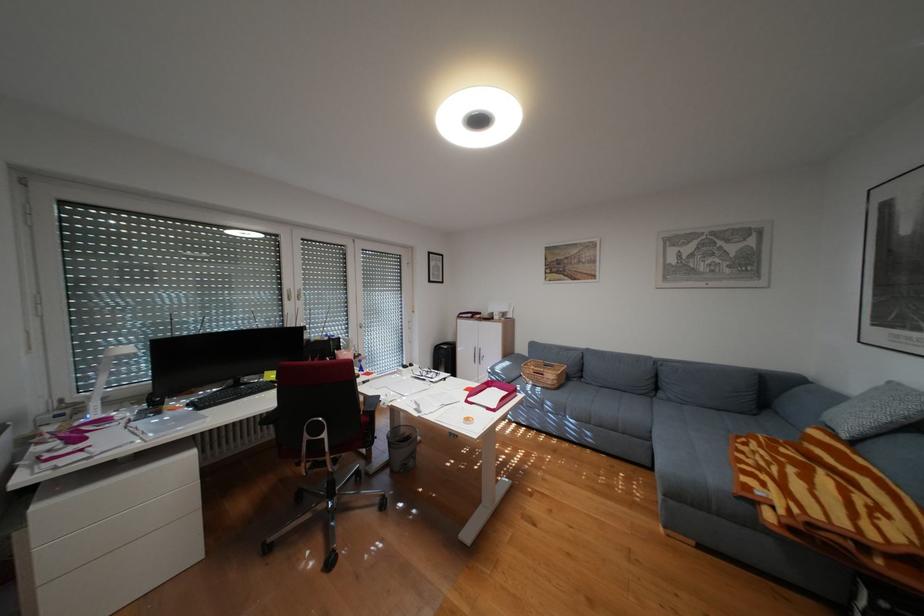
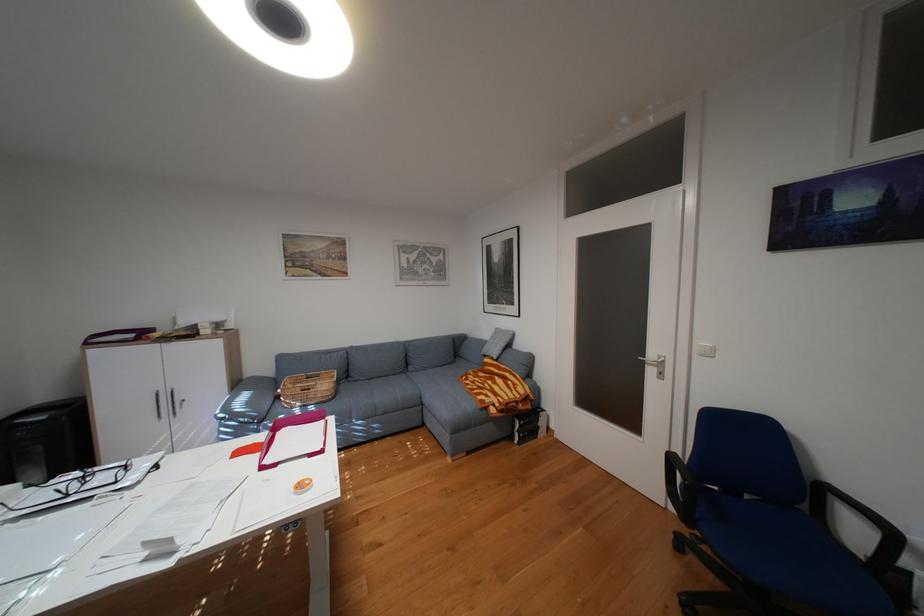
In the second image, find the point that corresponds to point (565, 365) in the first image.

(331, 375)